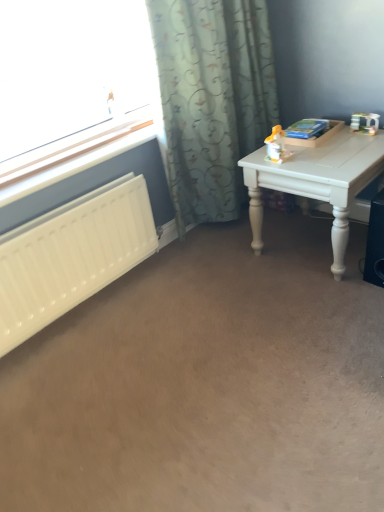
Where is `vacant space in white painted wood table at right (from a real-world perspective)`? This screenshot has width=384, height=512. vacant space in white painted wood table at right (from a real-world perspective) is located at coordinates (303, 242).